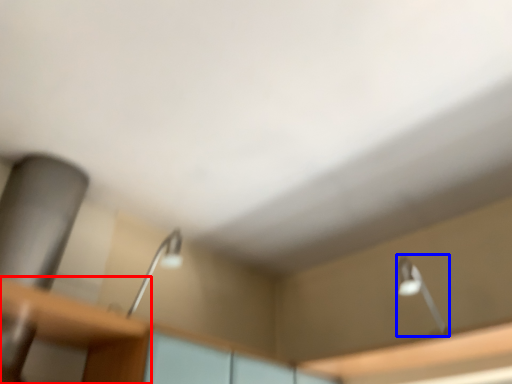
Question: Which of the following is the closest to the observer, table (highlighted by a red box) or lamp (highlighted by a blue box)?

Choices:
 (A) table
 (B) lamp

Answer: (A)